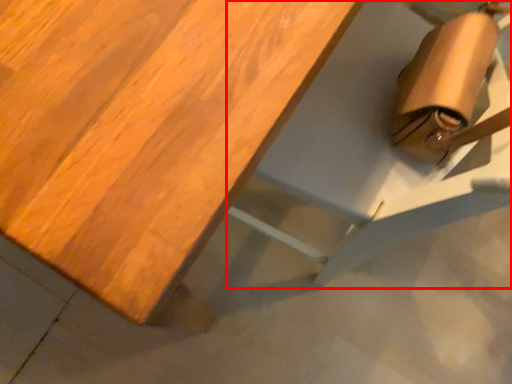
Question: Where is chair (annotated by the red box) located in relation to table in the image?

Choices:
 (A) left
 (B) right

Answer: (B)